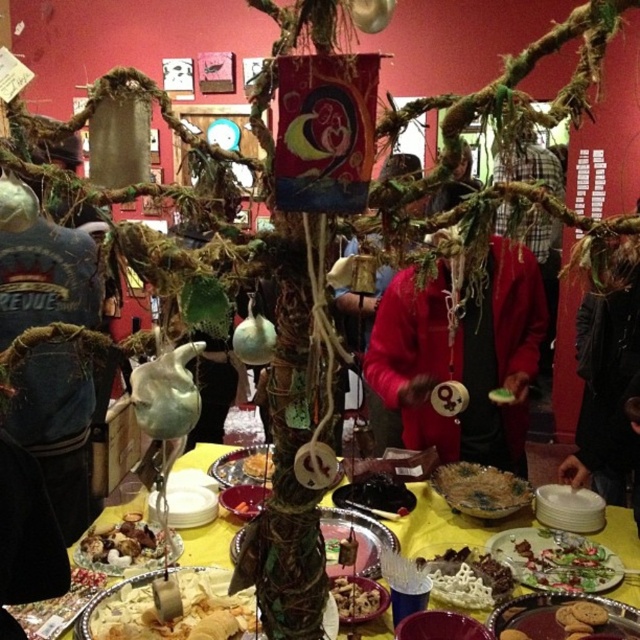
Does velvet red sweater at center have a greater width compared to dark gray jacket at center?

No.

Between point (412, 273) and point (612, 467), which one is positioned behind?

The point (412, 273) is behind.

Locate an element on the screen. velvet red sweater at center is located at coordinates (461, 356).

Can you confirm if velvet red sweater at center is thinner than golden brown bread at lower left?

In fact, velvet red sweater at center might be wider than golden brown bread at lower left.

Can you confirm if velvet red sweater at center is shorter than golden brown bread at lower left?

No, velvet red sweater at center is not shorter than golden brown bread at lower left.

This screenshot has width=640, height=640. What do you see at coordinates (461, 356) in the screenshot? I see `velvet red sweater at center` at bounding box center [461, 356].

The height and width of the screenshot is (640, 640). I want to click on velvet red sweater at center, so click(x=461, y=356).

Measure the distance between dark gray jacket at center and camera.

The distance of dark gray jacket at center from camera is 36.13 inches.

Can you confirm if dark gray jacket at center is shorter than golden shredded paper at center?

In fact, dark gray jacket at center may be taller than golden shredded paper at center.

Identify the location of dark gray jacket at center. (609, 388).

You are a GUI agent. You are given a task and a screenshot of the screen. Output one action in this format:
    pyautogui.click(x=<x>, y=<y>)
    Task: Click on the dark gray jacket at center
    This screenshot has width=640, height=640.
    Given the screenshot: What is the action you would take?
    pyautogui.click(x=609, y=388)